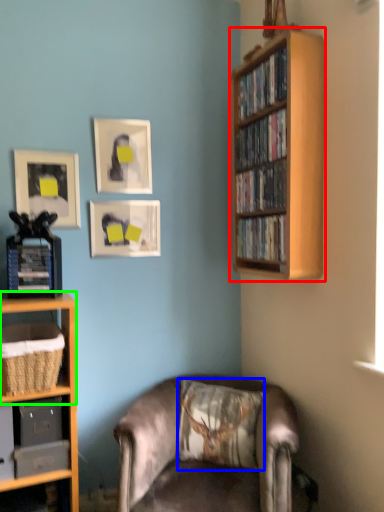
Question: Which is nearer to the bookcase (highlighted by a red box)? pillow (highlighted by a blue box) or shelf (highlighted by a green box).

Choices:
 (A) pillow
 (B) shelf

Answer: (A)